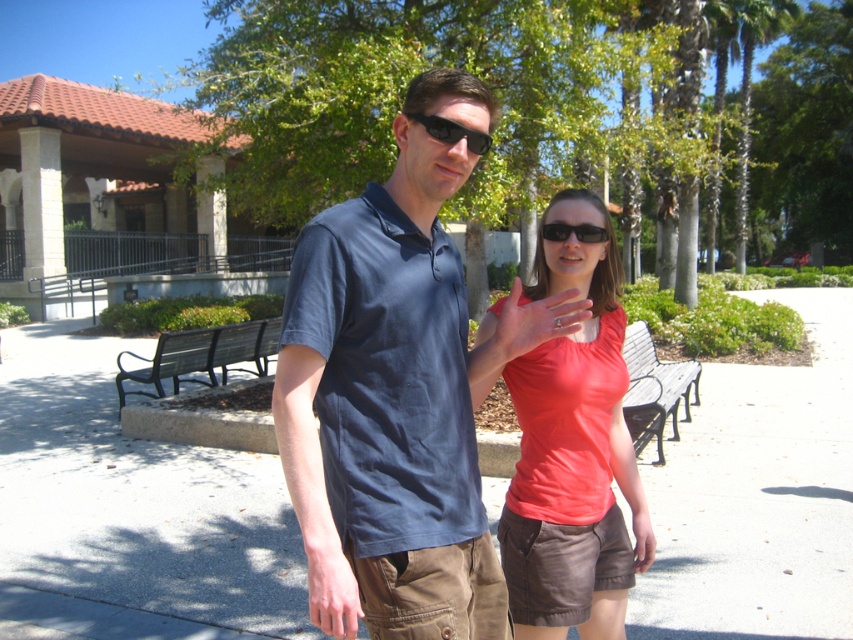
You are a delivery person who needs to place a small package on the gray concrete pavement at center and the black plastic sunglasses at center. Which surface is large enough to hold the package without it overlapping?

The gray concrete pavement at center is bigger than black plastic sunglasses at center, so the package can be placed on the gray concrete pavement at center without overlapping.

You are standing in the park and see the gray concrete pavement at center and the black plastic sunglasses at center. Which object is located to the right of the other?

The gray concrete pavement at center is located to the right of the black plastic sunglasses at center.